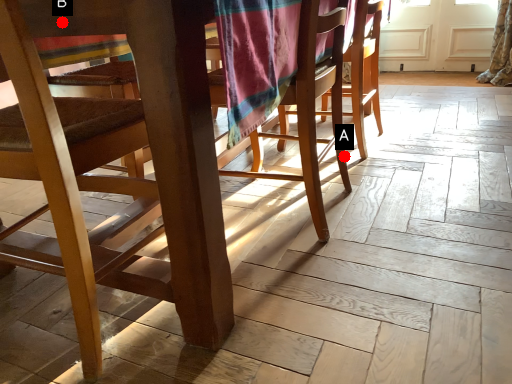
Question: Two points are circled on the image, labeled by A and B beside each circle. Which point appears closest to the camera in this image?

Choices:
 (A) A is closer
 (B) B is closer

Answer: (B)